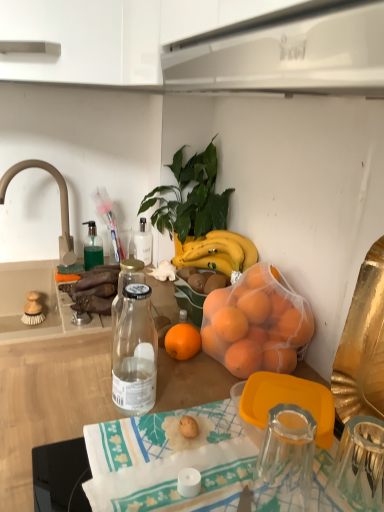
Locate an element on the screen. The height and width of the screenshot is (512, 384). unoccupied region to the right of transparent glass coffee cup at center is located at coordinates (351, 479).